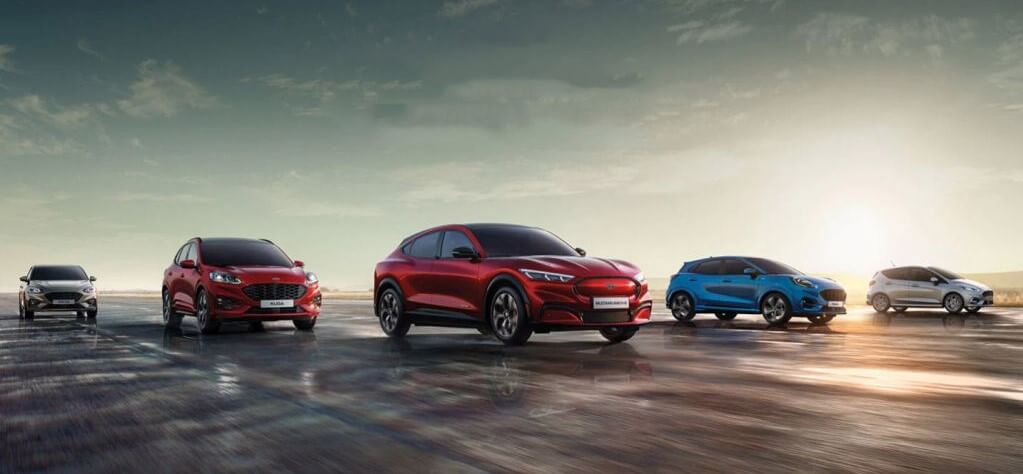
Identify the location of side windows. (180, 251), (190, 254), (427, 243), (459, 246), (711, 266), (731, 264), (900, 272), (919, 273).